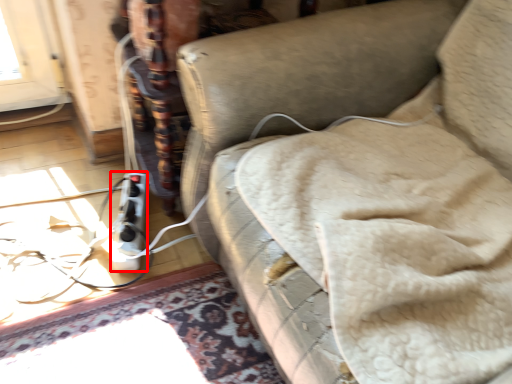
Question: Where is extension cord (annotated by the red box) located in relation to furniture in the image?

Choices:
 (A) right
 (B) left

Answer: (B)